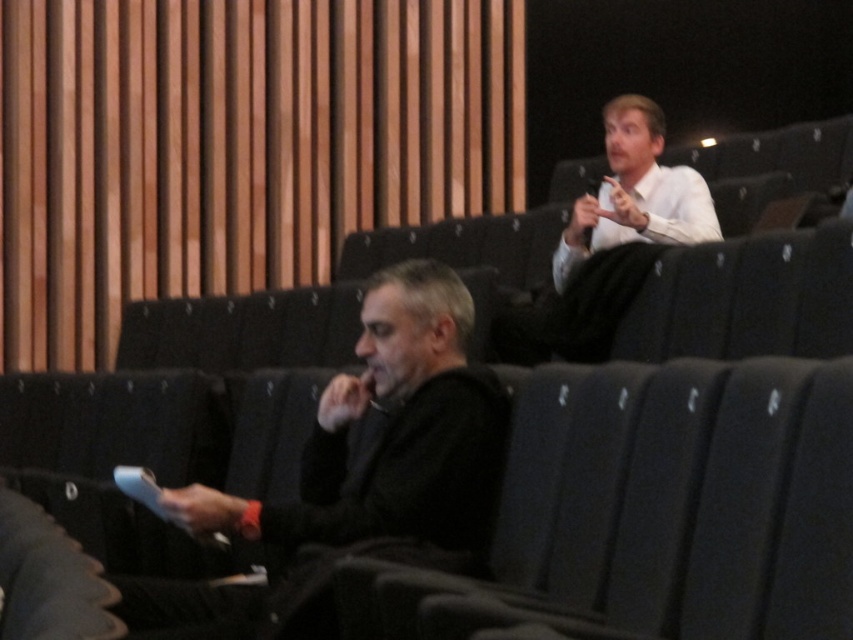
Is black matte jacket at lower left positioned at the back of white glossy shirt at upper right?

No, it is in front of white glossy shirt at upper right.

Does point (201, 513) come farther from viewer compared to point (683, 182)?

That is False.

Does point (503, 396) lie in front of point (645, 234)?

Yes, point (503, 396) is in front of point (645, 234).

This screenshot has height=640, width=853. In order to click on black matte jacket at lower left in this screenshot , I will do (390, 440).